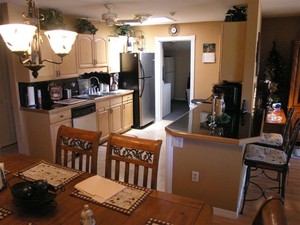
Locate an element on the screen. The height and width of the screenshot is (225, 300). tile is located at coordinates (153, 134).